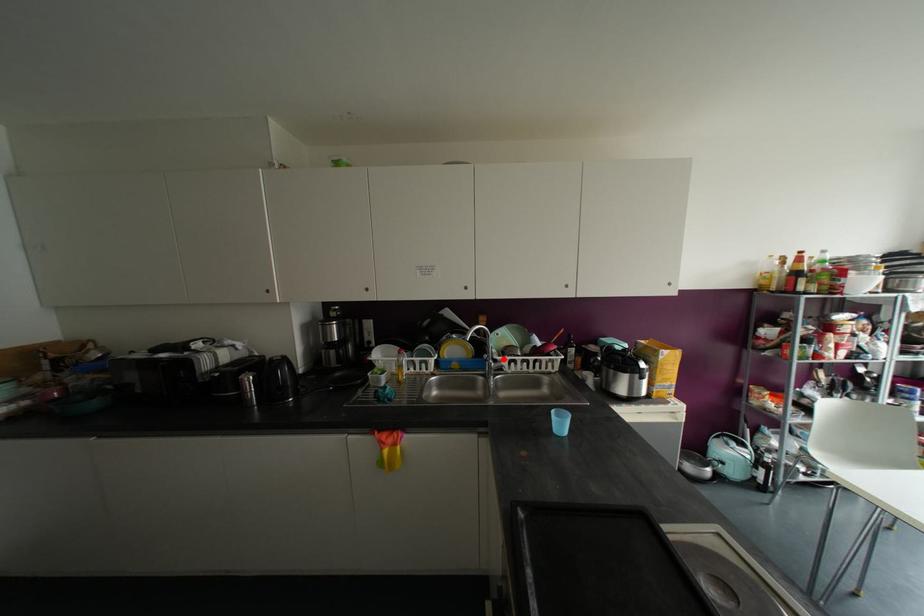
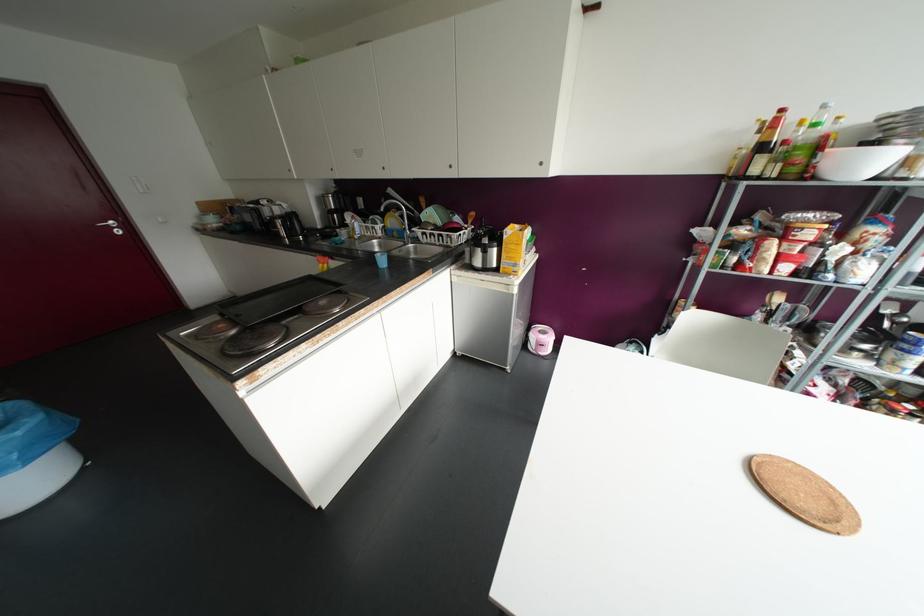
Question: A red point is marked in image1. In image2, is the corresponding 3D point closer to the camera or farther? Reply with the corresponding letter.

Choices:
 (A) The corresponding 3D point is closer.
 (B) The corresponding 3D point is farther.

Answer: (A)